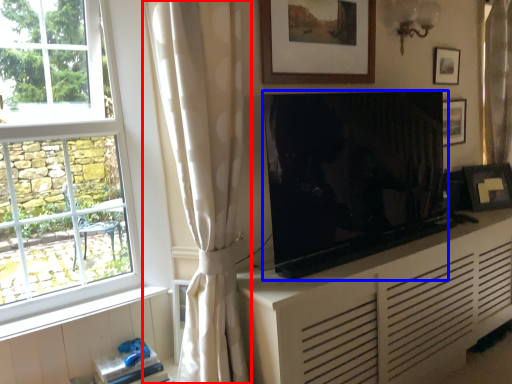
Question: Which point is further to the camera, curtain (highlighted by a red box) or television (highlighted by a blue box)?

Choices:
 (A) curtain
 (B) television

Answer: (B)